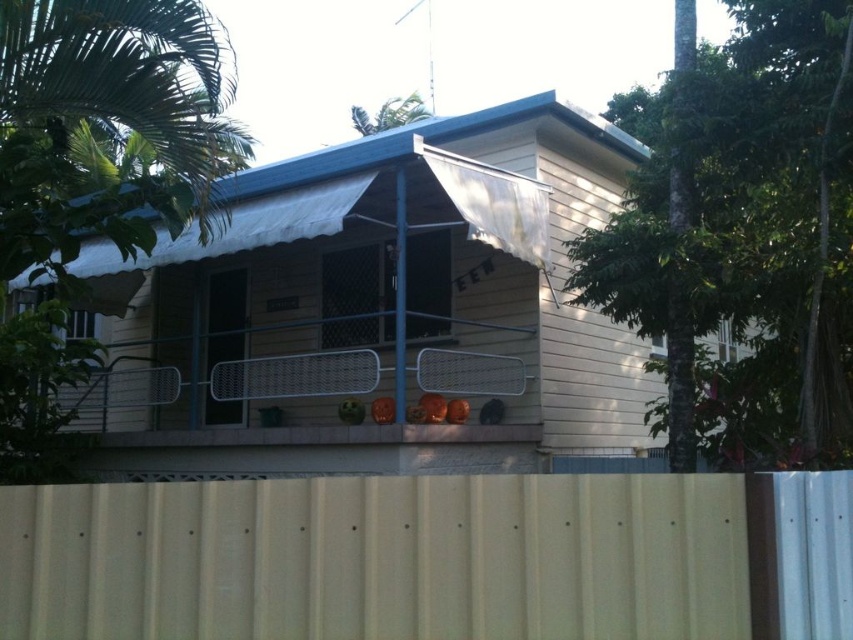
Question: Does tan corrugated metal at lower center appear on the right side of metallic mesh balcony at center?

Choices:
 (A) yes
 (B) no

Answer: (A)

Question: Does tan corrugated metal at lower center appear over metallic mesh balcony at center?

Choices:
 (A) yes
 (B) no

Answer: (B)

Question: Which object is closer to the camera taking this photo?

Choices:
 (A) tan corrugated metal at lower center
 (B) metallic mesh balcony at center

Answer: (A)

Question: Does tan corrugated metal at lower center lie behind metallic mesh balcony at center?

Choices:
 (A) yes
 (B) no

Answer: (B)